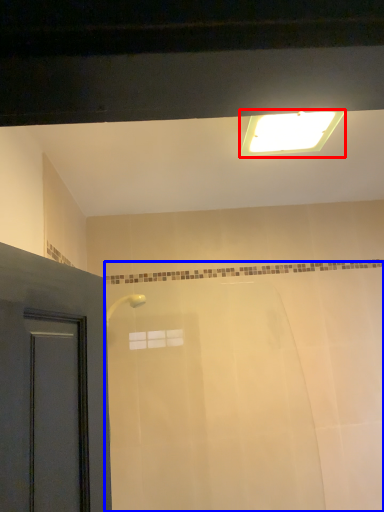
Question: Which object appears closest to the camera in this image, lighting (highlighted by a red box) or bath (highlighted by a blue box)?

Choices:
 (A) lighting
 (B) bath

Answer: (A)